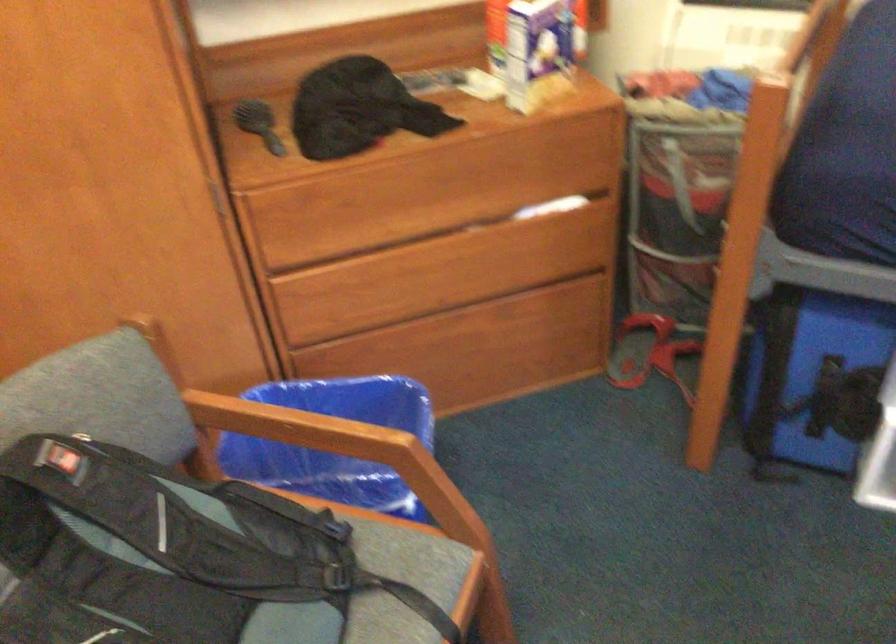
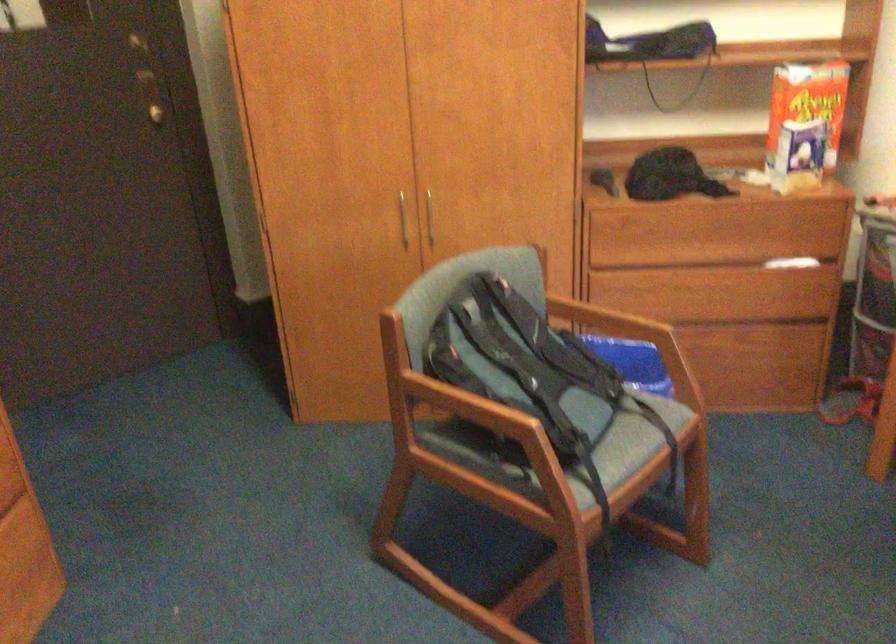
Question: What movement of the cameraman would produce the second image?

Choices:
 (A) Left
 (B) Right
 (C) Forward
 (D) Backward

Answer: (D)